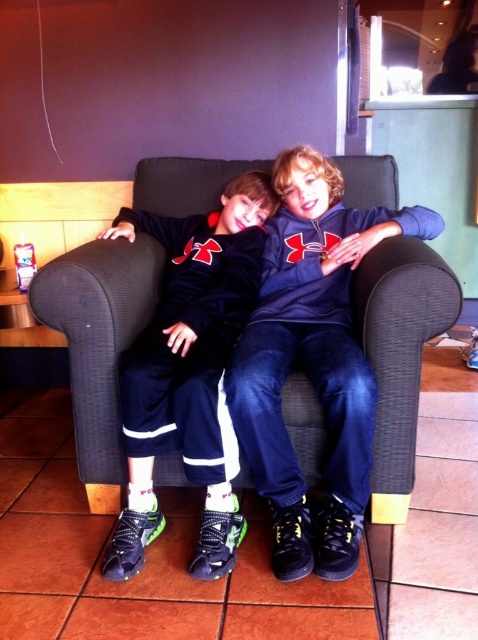
You are a photographer standing in front of the matte blue hoodie at center. You want to take a photo of it without any blur. Your camera requires a minimum distance of 1.5 meters to focus properly. Can you take a clear photo from your current position?

The distance between the matte blue hoodie at center and the camera is 1.26 meters, which is less than the required 1.5 meters. Therefore, you cannot take a clear photo from your current position without blur.

Based on the scene description, where is the dark blue fabric couch at center located in terms of coordinates?

The dark blue fabric couch at center is located at coordinates point (98, 340).